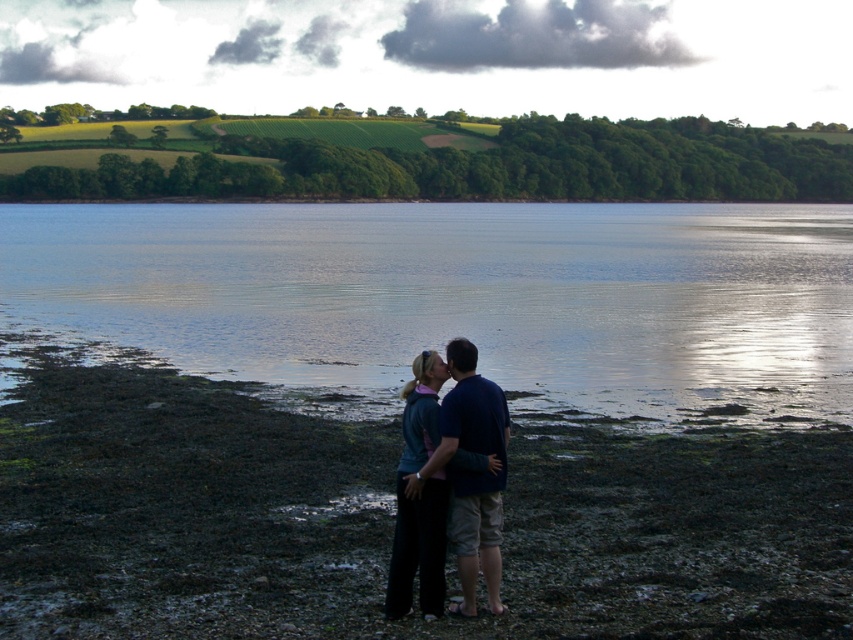
Question: Which point is closer to the camera?

Choices:
 (A) clear water at center
 (B) dull brown mud at lower center

Answer: (B)

Question: Is dull brown mud at lower center above clear water at center?

Choices:
 (A) no
 (B) yes

Answer: (A)

Question: Does dull brown mud at lower center come behind dark blue fabric couple at center?

Choices:
 (A) yes
 (B) no

Answer: (B)

Question: Can you confirm if dull brown mud at lower center is positioned to the right of dark blue fabric couple at center?

Choices:
 (A) yes
 (B) no

Answer: (B)

Question: Among these objects, which one is nearest to the camera?

Choices:
 (A) dark blue fabric couple at center
 (B) dull brown mud at lower center

Answer: (B)

Question: Which object is closer to the camera taking this photo?

Choices:
 (A) clear water at center
 (B) dull brown mud at lower center

Answer: (B)